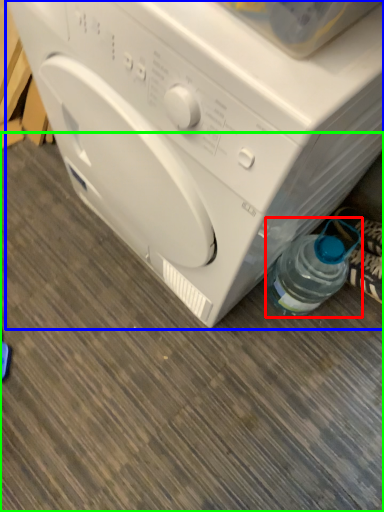
Question: Estimate the real-world distances between objects in this image. Which object is closer to bottle (highlighted by a red box), washing machine (highlighted by a blue box) or surface (highlighted by a green box)?

Choices:
 (A) washing machine
 (B) surface

Answer: (A)